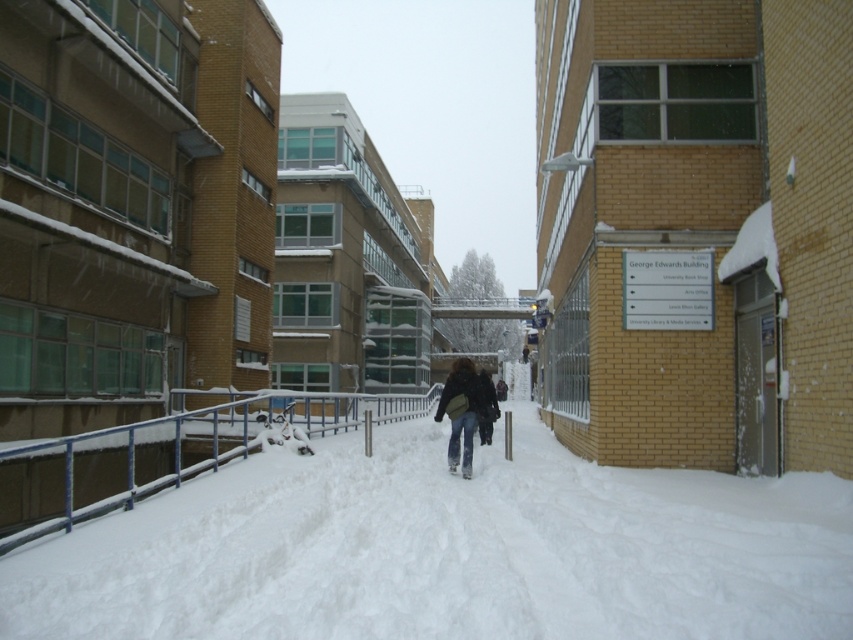
You are a delivery person trying to walk through the snowy area in the image. You see the white powdery snow at center and the denim jacket at center. Which one is wider so you can decide where to step?

The white powdery snow at center is wider than the denim jacket at center, so stepping on the white powdery snow at center would provide a wider path.

You are standing at the edge of the snowy path in the image and want to see if you can step over the blue painted metal railing at lower center while wearing the denim jacket at center. Can you do it?

The blue painted metal railing at lower center is much taller than the denim jacket at center, so stepping over it might be difficult or impossible due to its height.

You are standing in the snowy urban scene described. You want to place a small potted plant between the white powdery snow at center and the denim jacket at center. Considering their heights, which object should the plant be placed closer to?

The white powdery snow at center has a lesser height compared to the denim jacket at center. Therefore, the plant should be placed closer to the denim jacket at center to ensure stability, as it provides a higher base.